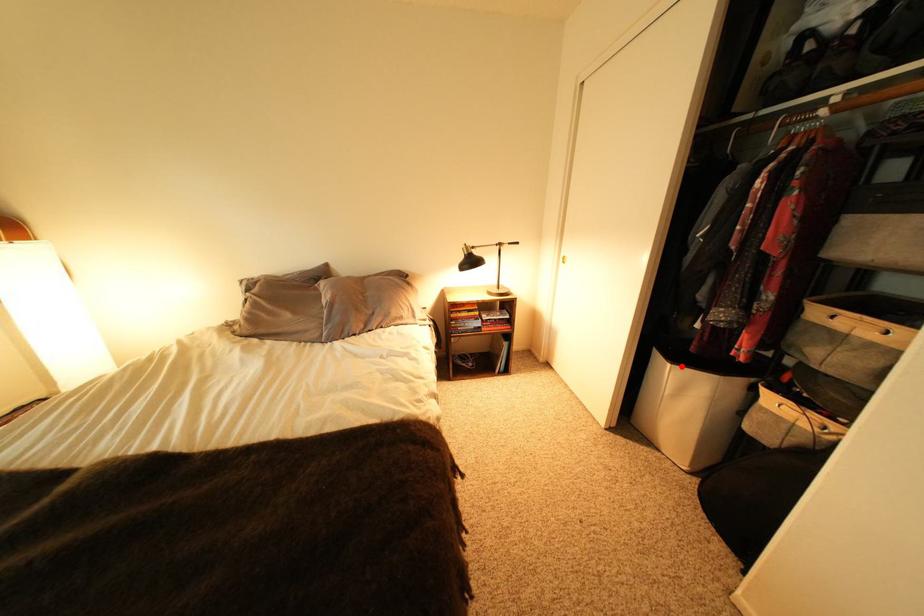
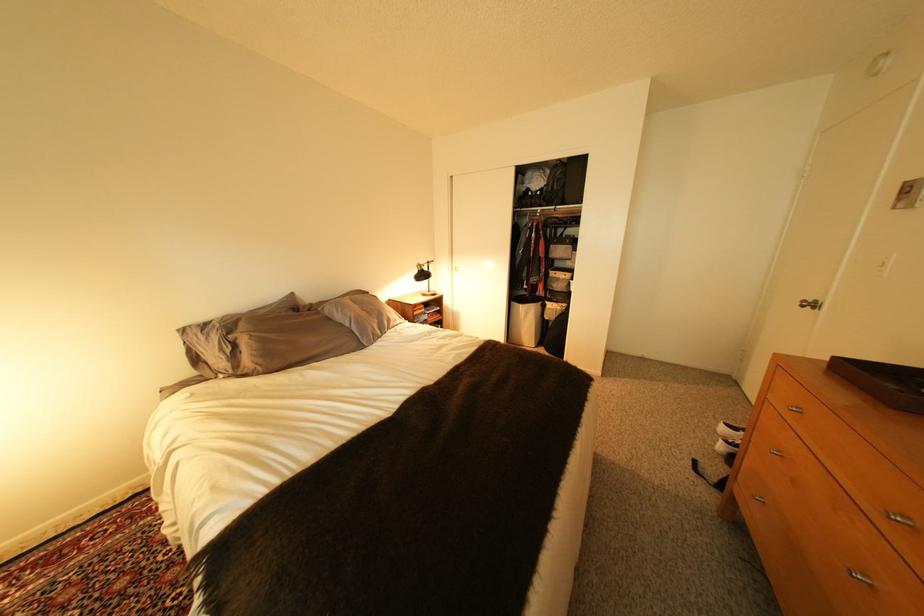
Where in the second image is the point corresponding to the highlighted location from the first image?

(533, 307)